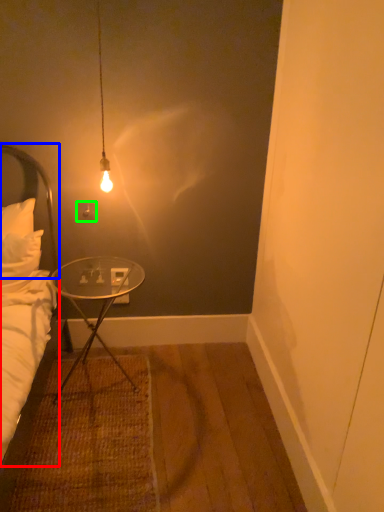
Question: Which object is positioned farthest from bed (highlighted by a red box)? Select from headboard (highlighted by a blue box) and power outlet (highlighted by a green box).

Choices:
 (A) headboard
 (B) power outlet

Answer: (B)